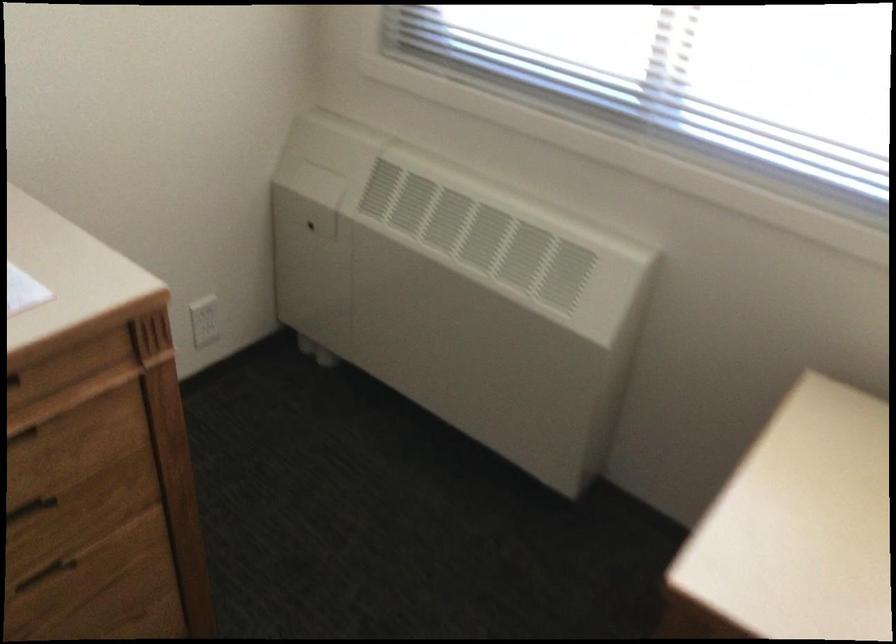
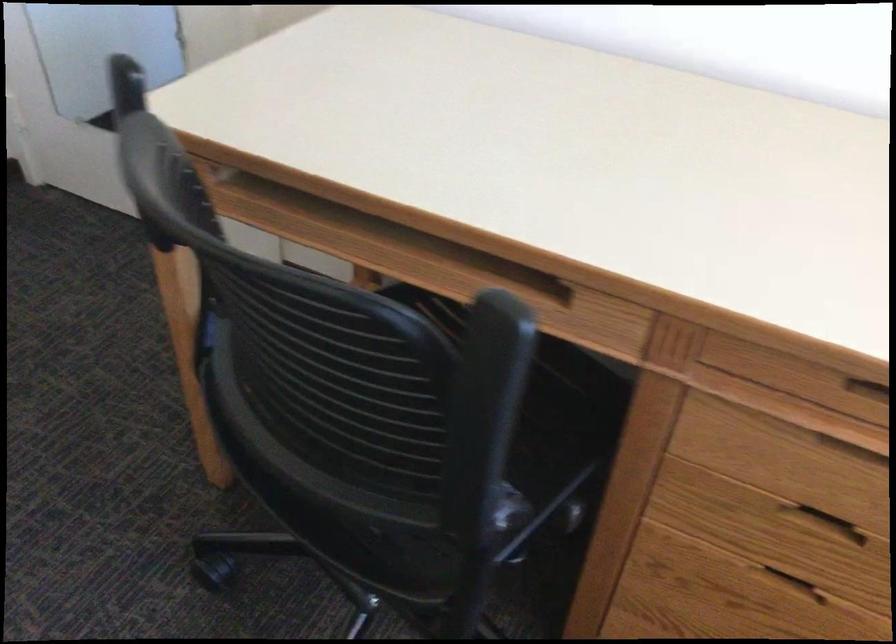
The first image is from the beginning of the video and the second image is from the end. How did the camera likely rotate when shooting the video?

The camera's rotation is toward left-down.